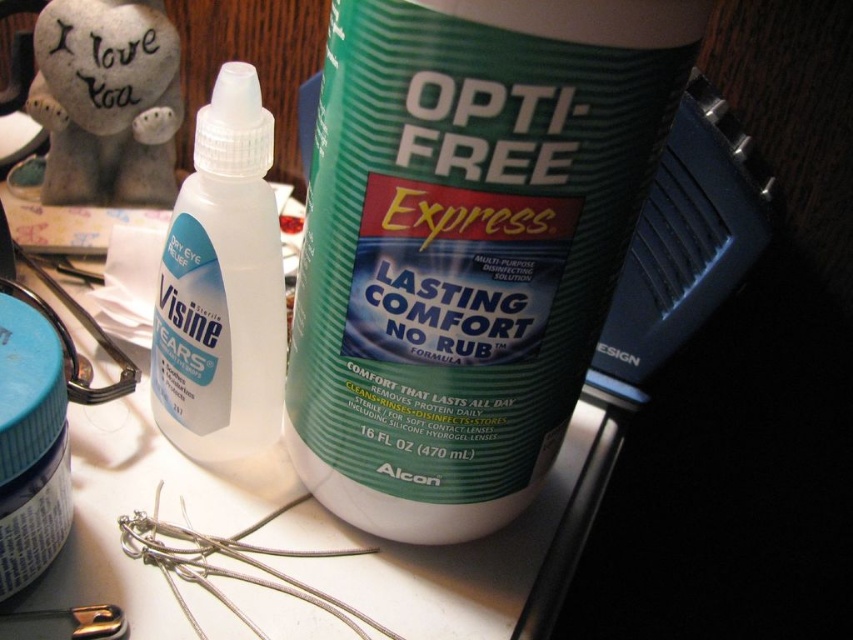
Question: Can you confirm if transparent plastic bottle at center-left is positioned to the left of gray fabric teddy bear at upper left?

Choices:
 (A) no
 (B) yes

Answer: (A)

Question: Which object is closer to the camera taking this photo?

Choices:
 (A) gray fabric teddy bear at upper left
 (B) green plastic bottle at center

Answer: (B)

Question: Is green plastic bottle at center to the left of matte blue jar at lower left from the viewer's perspective?

Choices:
 (A) yes
 (B) no

Answer: (B)

Question: Estimate the real-world distances between objects in this image. Which object is closer to the transparent plastic bottle at center-left?

Choices:
 (A) green plastic bottle at center
 (B) gray fabric teddy bear at upper left
 (C) matte blue jar at lower left

Answer: (A)

Question: Which is nearer to the matte blue jar at lower left?

Choices:
 (A) green plastic bottle at center
 (B) transparent plastic bottle at center-left

Answer: (B)

Question: Can you confirm if green plastic bottle at center is positioned below transparent plastic bottle at center-left?

Choices:
 (A) no
 (B) yes

Answer: (B)